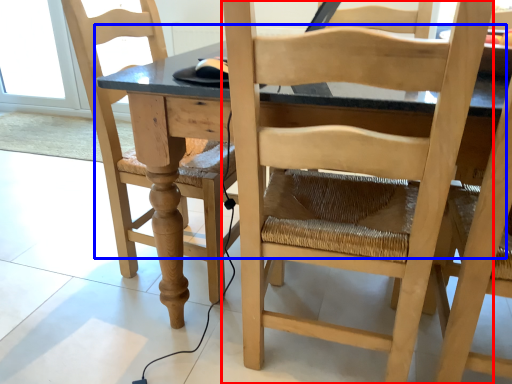
Question: Among these objects, which one is farthest to the camera, chair (highlighted by a red box) or table (highlighted by a blue box)?

Choices:
 (A) chair
 (B) table

Answer: (B)